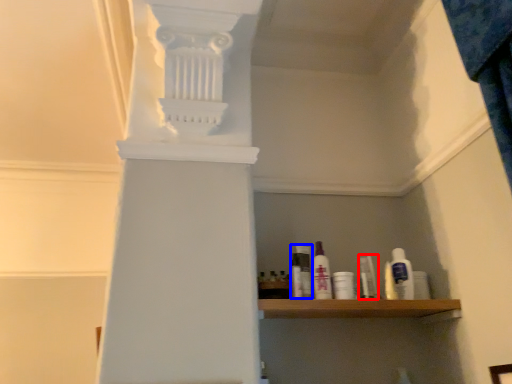
Question: Which of the following is the closest to the observer, toiletry (highlighted by a red box) or mouthwash (highlighted by a blue box)?

Choices:
 (A) toiletry
 (B) mouthwash

Answer: (B)